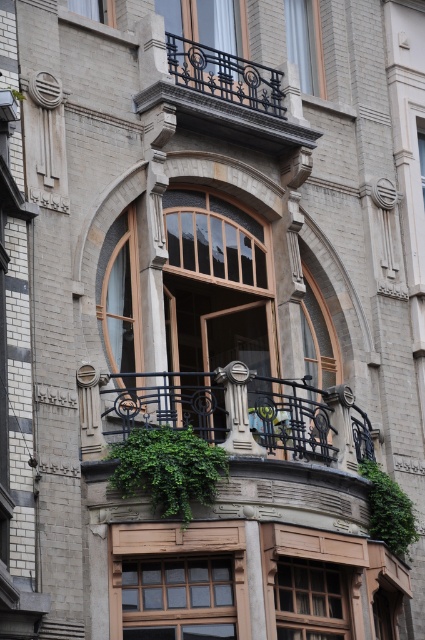
Question: Is black wrought iron railing at upper center behind dark gray wrought iron at upper center?

Choices:
 (A) yes
 (B) no

Answer: (A)

Question: Can you confirm if wooden window at lower center is positioned above green leafy plant at center?

Choices:
 (A) yes
 (B) no

Answer: (B)

Question: Which is farther from the clear glass window at center?

Choices:
 (A) green leafy plant at center
 (B) clear glass window at upper center
 (C) black wrought iron railing at upper center

Answer: (B)

Question: Is the position of wooden window at lower center more distant than that of clear glass window at center?

Choices:
 (A) yes
 (B) no

Answer: (B)

Question: Among these objects, which one is farthest from the camera?

Choices:
 (A) clear glass window at center
 (B) dark gray wrought iron balcony at upper center
 (C) clear glass window at upper left

Answer: (C)

Question: Which point is closer to the camera taking this photo?

Choices:
 (A) (132, 316)
 (B) (283, 570)
 (C) (280, 125)

Answer: (B)